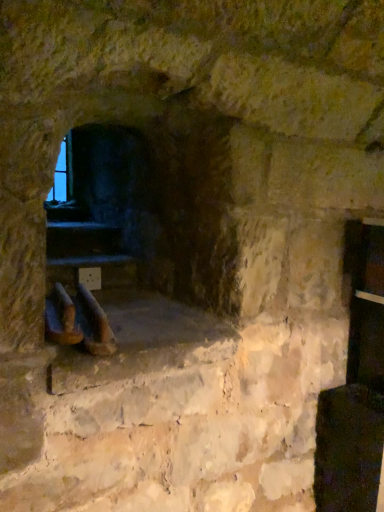
Question: From the image's perspective, is dark stone fireplace at center located above brown leather boot at lower left, the 1th footwear when ordered from left to right?

Choices:
 (A) no
 (B) yes

Answer: (B)

Question: Is dark stone fireplace at center touching brown leather boot at lower left, marked as the second footwear in a right-to-left arrangement?

Choices:
 (A) no
 (B) yes

Answer: (A)

Question: Is dark stone fireplace at center positioned behind brown leather boot at lower left, the 1th footwear when ordered from left to right?

Choices:
 (A) yes
 (B) no

Answer: (A)

Question: Is dark stone fireplace at center positioned far away from brown leather boot at lower left, marked as the second footwear in a right-to-left arrangement?

Choices:
 (A) yes
 (B) no

Answer: (B)

Question: Is dark stone fireplace at center shorter than brown leather boot at lower left, the 1th footwear when ordered from left to right?

Choices:
 (A) yes
 (B) no

Answer: (B)

Question: Is brown leather boot at lower left, the 1th footwear when ordered from left to right, a part of dark stone fireplace at center?

Choices:
 (A) no
 (B) yes

Answer: (A)

Question: Is brown leather boot at lower left, marked as the second footwear in a right-to-left arrangement, oriented away from dark stone fireplace at center?

Choices:
 (A) no
 (B) yes

Answer: (A)

Question: Is brown leather boot at lower left, the 1th footwear when ordered from left to right, oriented towards dark stone fireplace at center?

Choices:
 (A) no
 (B) yes

Answer: (A)

Question: Can you confirm if brown leather boot at lower left, marked as the second footwear in a right-to-left arrangement, is taller than dark stone fireplace at center?

Choices:
 (A) no
 (B) yes

Answer: (A)

Question: Does brown leather boot at lower left, the 1th footwear when ordered from left to right, have a lesser width compared to dark stone fireplace at center?

Choices:
 (A) yes
 (B) no

Answer: (B)

Question: From a real-world perspective, is brown leather boot at lower left, marked as the second footwear in a right-to-left arrangement, under dark stone fireplace at center?

Choices:
 (A) no
 (B) yes

Answer: (B)

Question: Is brown leather boot at lower left, the 1th footwear when ordered from left to right, closer to the viewer compared to dark stone fireplace at center?

Choices:
 (A) no
 (B) yes

Answer: (B)

Question: Considering the relative sizes of brown leather boot at lower left, the 1th footwear when ordered from left to right, and brown leather boot at center, which is the second footwear from left to right, in the image provided, is brown leather boot at lower left, the 1th footwear when ordered from left to right, taller than brown leather boot at center, which is the second footwear from left to right,?

Choices:
 (A) no
 (B) yes

Answer: (A)